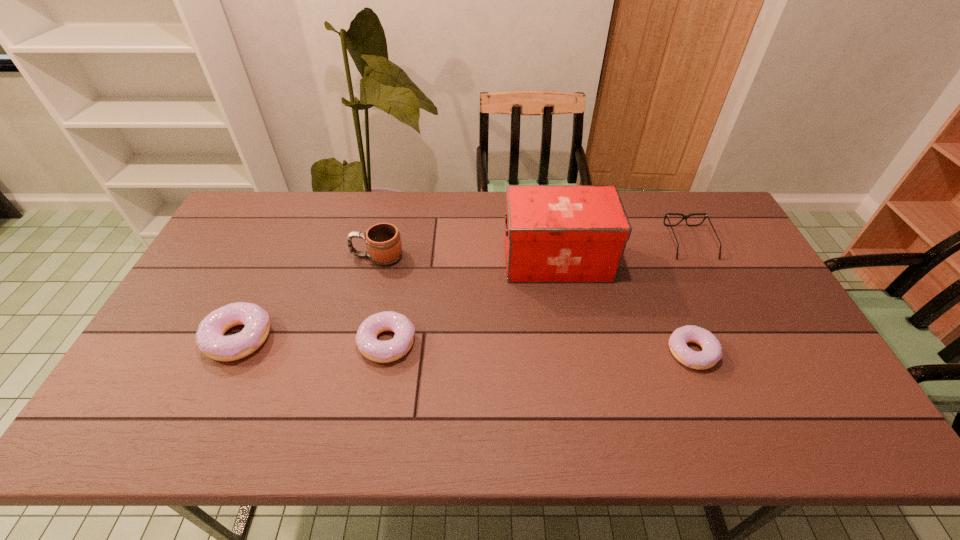
Locate an element on the screen. The width and height of the screenshot is (960, 540). the leftmost doughnut is located at coordinates (210, 339).

I want to click on the second doughnut from right to left, so click(x=373, y=349).

At what (x,y) coordinates should I click in order to perform the action: click on the shortest object. Please return your answer as a coordinate pair (x, y). The height and width of the screenshot is (540, 960). Looking at the image, I should click on (711, 353).

Locate an element on the screen. The height and width of the screenshot is (540, 960). the rightmost doughnut is located at coordinates (711, 353).

The image size is (960, 540). Find the location of `spectacles`. spectacles is located at coordinates (706, 215).

Where is `the first-aid kit`? This screenshot has width=960, height=540. the first-aid kit is located at coordinates (553, 233).

This screenshot has width=960, height=540. I want to click on the tallest object, so click(x=553, y=233).

Identify the location of the second tallest object. coord(383,241).

The image size is (960, 540). Identify the location of free space located 0.210m on the back of the leftmost doughnut. tap(275, 261).

Locate an element on the screen. vacant space located on the front of the second doughnut from left to right is located at coordinates (379, 384).